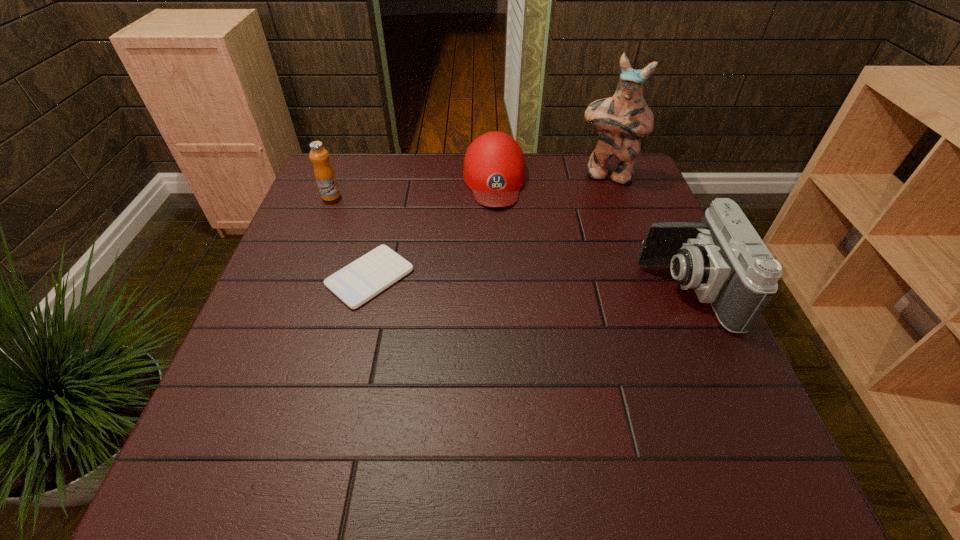
At what (x,y) coordinates should I click in order to perform the action: click on vacant space in between the orange juice and the camera. Please return your answer as a coordinate pair (x, y). The height and width of the screenshot is (540, 960). Looking at the image, I should click on click(x=509, y=242).

You are a GUI agent. You are given a task and a screenshot of the screen. Output one action in this format:
    pyautogui.click(x=<x>, y=<y>)
    Task: Click on the vacant area between the third object from left to right and the tallest object
    
    Given the screenshot: What is the action you would take?
    pyautogui.click(x=550, y=178)

What are the coordinates of `free space between the leftmost object and the shortest object` in the screenshot? It's located at (350, 237).

Where is `object that is the second closest to the fourth object from right to left`? This screenshot has width=960, height=540. object that is the second closest to the fourth object from right to left is located at coordinates (325, 177).

Select which object appears as the second closest to the third object from right to left. Please provide its 2D coordinates. Your answer should be formatted as a tuple, i.e. [(x, y)], where the tuple contains the x and y coordinates of a point satisfying the conditions above.

[(355, 284)]

Where is `free space that satisfies the following two spatial constraints: 1. on the front side of the tallest object; 2. at the front of the camera with an open lens cover`? free space that satisfies the following two spatial constraints: 1. on the front side of the tallest object; 2. at the front of the camera with an open lens cover is located at coordinates (646, 289).

Find the location of a particular element. This screenshot has width=960, height=540. vacant space that satisfies the following two spatial constraints: 1. on the front side of the orange juice; 2. at the front of the camera with an open lens cover is located at coordinates (294, 289).

In order to click on free space that satisfies the following two spatial constraints: 1. on the front side of the figurine; 2. at the front of the camera with an open lens cover in this screenshot , I will do `click(646, 289)`.